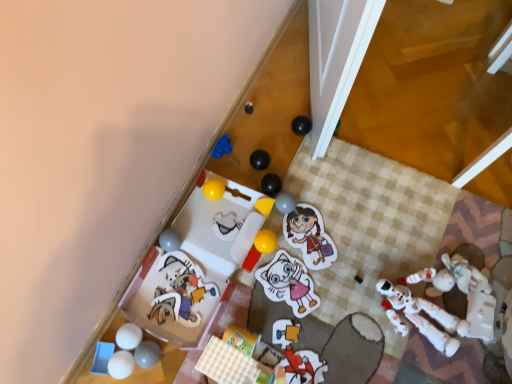
Where is `vacant area on the back side of cartoon cat plush at lower left, placed as the 11th toy when sorted from right to left`? The height and width of the screenshot is (384, 512). vacant area on the back side of cartoon cat plush at lower left, placed as the 11th toy when sorted from right to left is located at coordinates (202, 232).